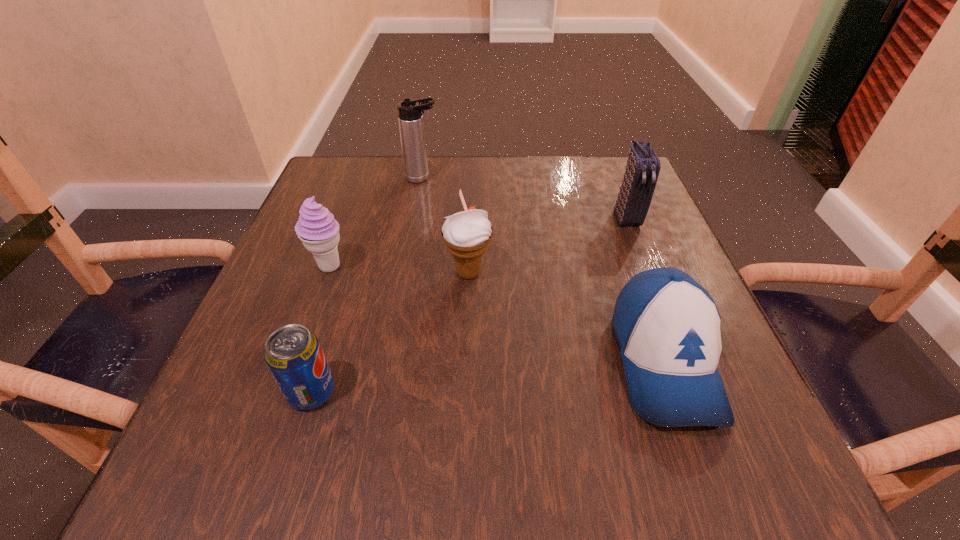
This screenshot has width=960, height=540. Identify the location of free region located on the front of the left icecream. (294, 366).

The width and height of the screenshot is (960, 540). Find the location of `free space located 0.060m on the front-facing side of the baseball cap`. free space located 0.060m on the front-facing side of the baseball cap is located at coordinates (709, 488).

This screenshot has width=960, height=540. In order to click on free region located on the front of the soda in this screenshot , I will do `click(290, 463)`.

Where is `thermos bottle at the far edge`? Image resolution: width=960 pixels, height=540 pixels. thermos bottle at the far edge is located at coordinates coord(410,117).

At what (x,y) coordinates should I click in order to perform the action: click on clutch bag that is positioned at the far edge. Please return your answer as a coordinate pair (x, y). Looking at the image, I should click on (643, 166).

You are a GUI agent. You are given a task and a screenshot of the screen. Output one action in this format:
    pyautogui.click(x=<x>, y=<y>)
    Task: Click on the object positioned at the near edge
    This screenshot has width=960, height=540.
    Given the screenshot: What is the action you would take?
    pyautogui.click(x=667, y=326)

At what (x,y) coordinates should I click in order to perform the action: click on icecream situated at the left edge. Please return your answer as a coordinate pair (x, y). This screenshot has width=960, height=540. Looking at the image, I should click on (317, 229).

Identify the location of soda present at the left edge. The image size is (960, 540). (293, 354).

Find the location of a particular element. clutch bag located at the right edge is located at coordinates (643, 166).

Find the location of a particular element. This screenshot has width=960, height=540. baseball cap situated at the right edge is located at coordinates coord(667,326).